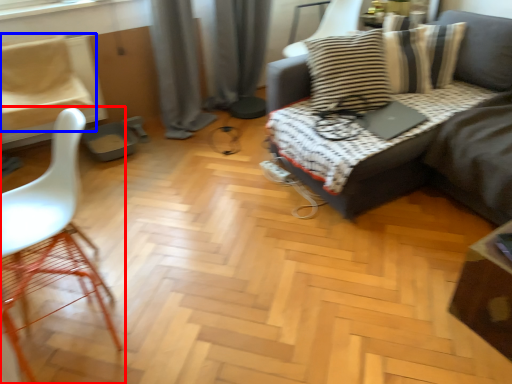
Question: Which object is closer to the camera taking this photo, chair (highlighted by a red box) or chair (highlighted by a blue box)?

Choices:
 (A) chair
 (B) chair

Answer: (A)